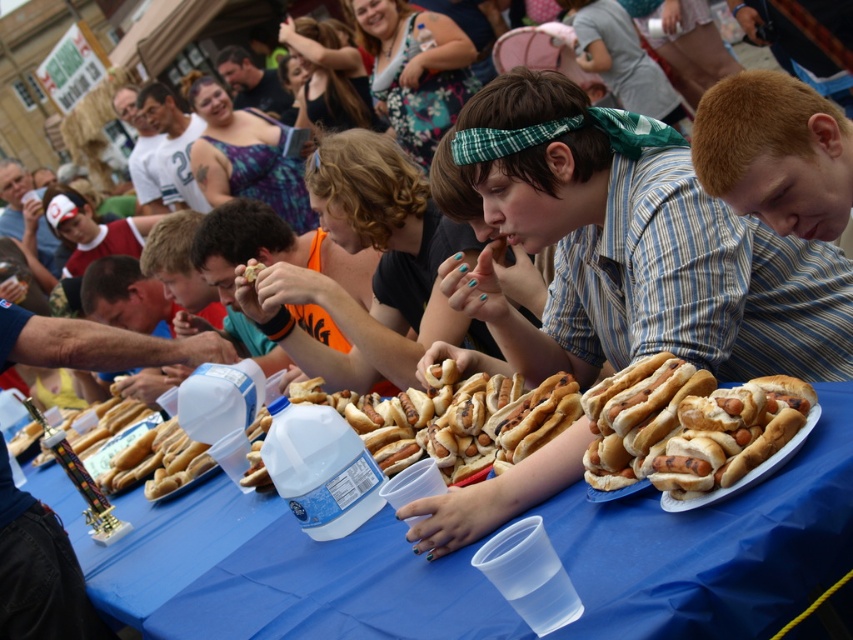
Question: Which object appears closest to the camera in this image?

Choices:
 (A) white jersey at upper left
 (B) matte blue shirt at center
 (C) blue plastic table at center

Answer: (C)

Question: Is matte blue shirt at center smaller than golden brown bun at center?

Choices:
 (A) no
 (B) yes

Answer: (A)

Question: Which point is closer to the camera taking this photo?

Choices:
 (A) [x=608, y=486]
 (B) [x=276, y=541]

Answer: (A)

Question: Is blue plastic table at center bigger than matte black shirt at upper center?

Choices:
 (A) no
 (B) yes

Answer: (A)

Question: Based on their relative distances, which object is farther from the matte black shirt at upper center?

Choices:
 (A) blue plastic table at center
 (B) white jersey at upper left
 (C) golden brown bun at center
 (D) matte blue shirt at center

Answer: (A)

Question: Is matte blue shirt at center below white jersey at upper left?

Choices:
 (A) yes
 (B) no

Answer: (A)